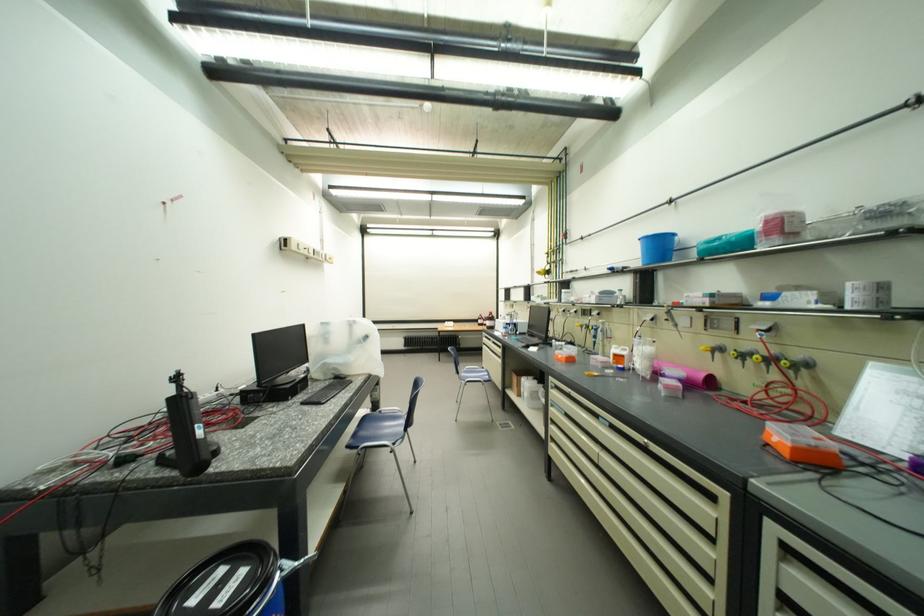
Image resolution: width=924 pixels, height=616 pixels. What do you see at coordinates (713, 349) in the screenshot?
I see `the yellow faucet handle` at bounding box center [713, 349].